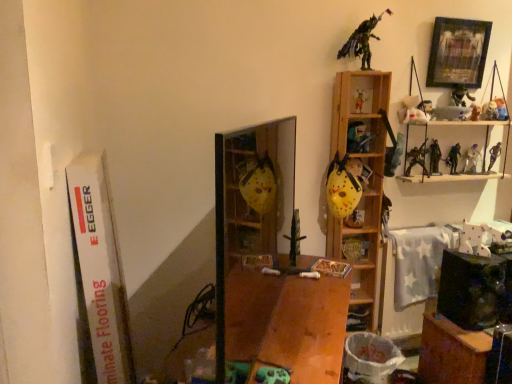
Image resolution: width=512 pixels, height=384 pixels. What are the coordinates of `free space to the left of wooden book at center` in the screenshot? It's located at click(308, 269).